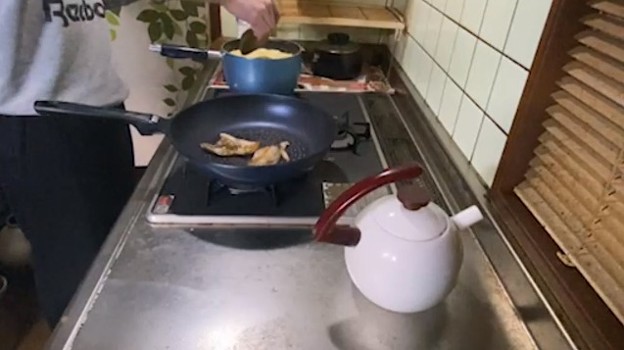
Where is `handle`? The width and height of the screenshot is (624, 350). handle is located at coordinates (332, 220), (417, 200), (102, 107), (197, 54), (334, 38).